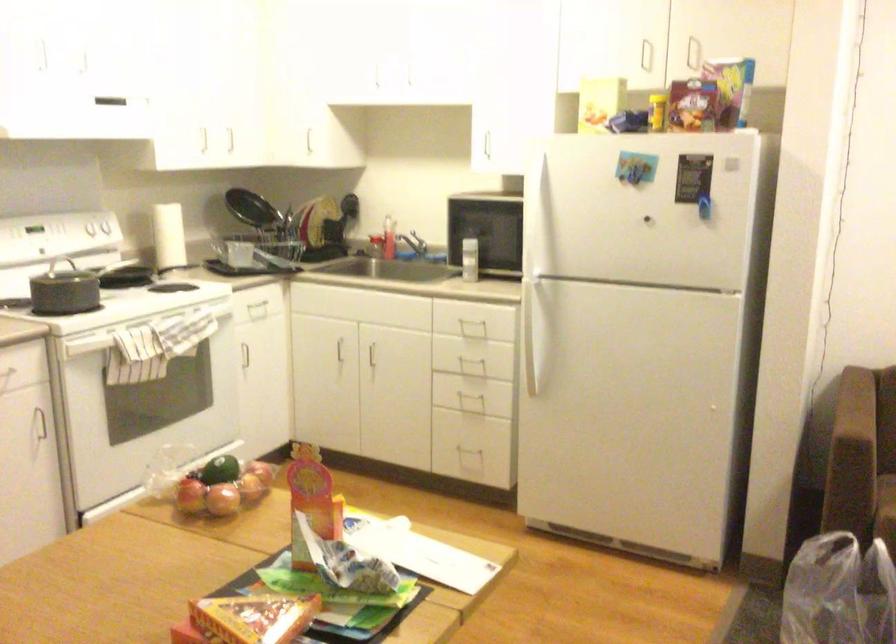
Where would you sit the sofa sitting surface? Please return your answer as a coordinate pair (x, y).

(863, 513)